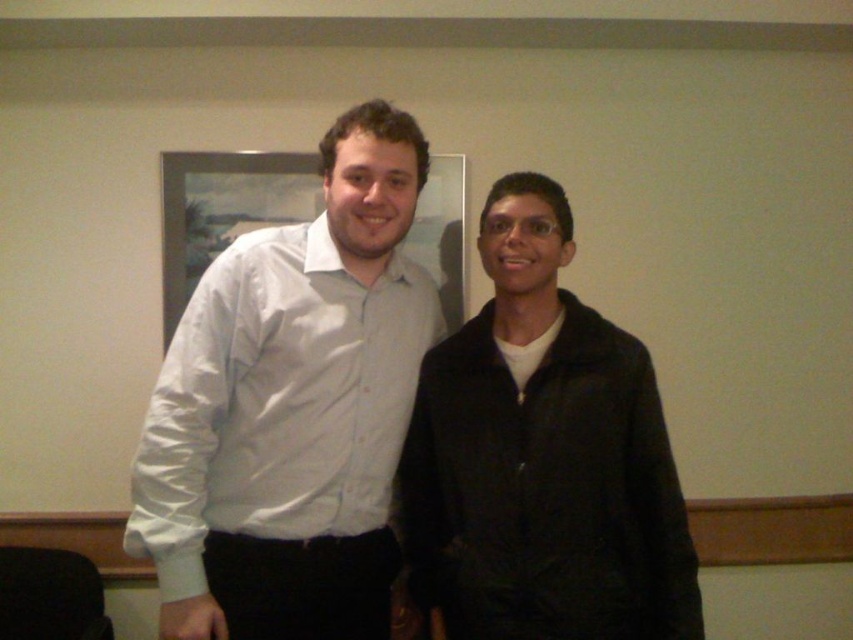
What do you see at coordinates (292, 410) in the screenshot? I see `white glossy shirt at center` at bounding box center [292, 410].

Does point (431, 300) lie in front of point (247, 156)?

That is True.

Find the location of `white glossy shirt at center`. white glossy shirt at center is located at coordinates (292, 410).

Looking at this image, which is more to the right, black matte jacket at right or white glossy frame at upper center?

Positioned to the right is black matte jacket at right.

Locate an element on the screen. The image size is (853, 640). black matte jacket at right is located at coordinates (543, 456).

Find the location of a particular element. black matte jacket at right is located at coordinates (543, 456).

Describe the element at coordinates (292, 410) in the screenshot. I see `white glossy shirt at center` at that location.

Locate an element on the screen. white glossy shirt at center is located at coordinates (292, 410).